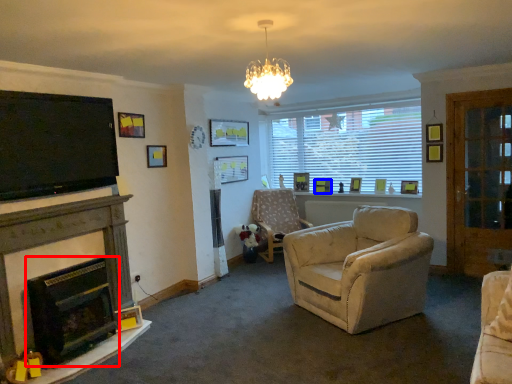
Question: Which object is closer to the camera taking this photo, fireplace (highlighted by a red box) or picture frame (highlighted by a blue box)?

Choices:
 (A) fireplace
 (B) picture frame

Answer: (A)